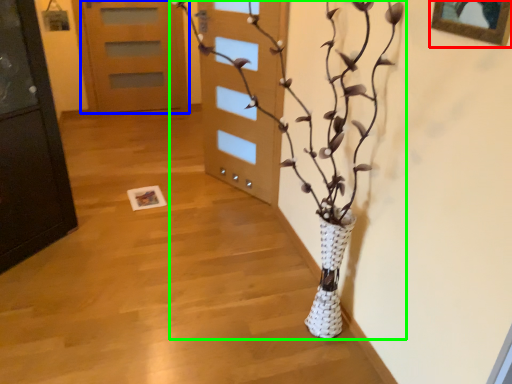
Question: Which is nearer to the picture frame (highlighted by a red box)? door (highlighted by a blue box) or houseplant (highlighted by a green box).

Choices:
 (A) door
 (B) houseplant

Answer: (B)